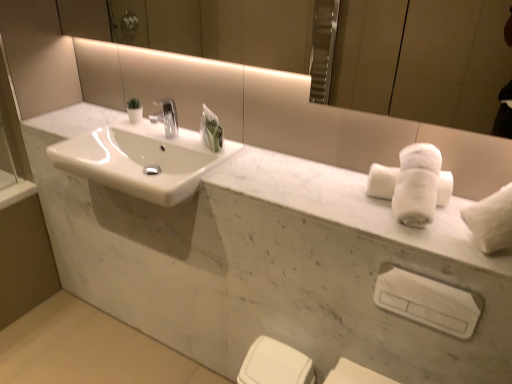
Where is `vacant space situated on the left part of white fluffy bath towel at right`? The width and height of the screenshot is (512, 384). vacant space situated on the left part of white fluffy bath towel at right is located at coordinates (314, 198).